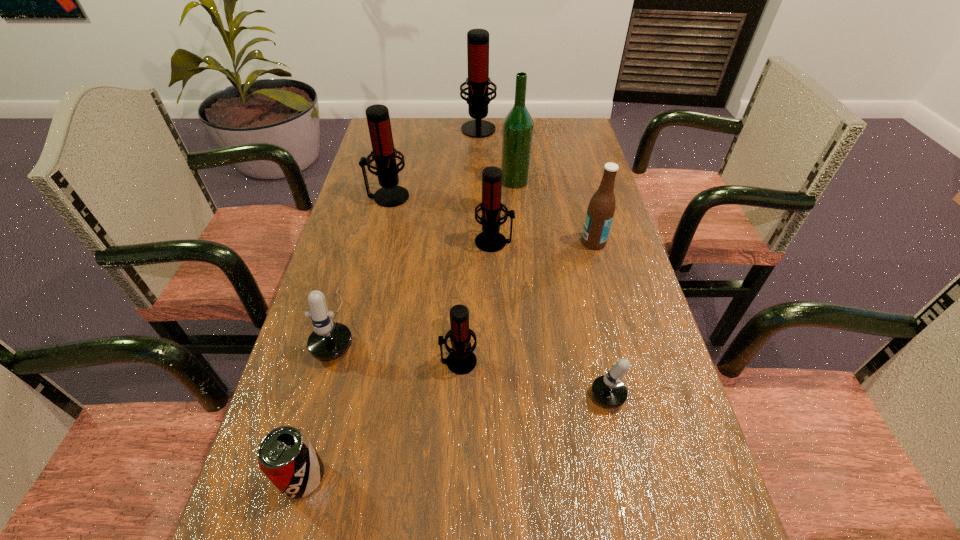
Find the location of a particular element. vacant space located 0.150m on the left of the nearest red microphone is located at coordinates (367, 362).

This screenshot has height=540, width=960. What are the coordinates of `free space located 0.090m on the front of the smaller white microphone` in the screenshot? It's located at (649, 462).

Find the location of `free space located on the back of the nearest object`. free space located on the back of the nearest object is located at coordinates (339, 342).

Identify the location of object that is at the far edge. (478, 81).

Find the location of a particular element. This screenshot has height=540, width=960. soda can at the left edge is located at coordinates (286, 456).

What are the coordinates of `beer bottle present at the right edge` in the screenshot? It's located at (601, 209).

I want to click on microphone located in the right edge section of the desktop, so click(608, 390).

Find the location of a particular element. The width and height of the screenshot is (960, 540). vacant area at the far edge of the desktop is located at coordinates (537, 151).

I want to click on vacant space at the left edge of the desktop, so click(338, 489).

Identify the location of free spot at the right edge of the desktop. Image resolution: width=960 pixels, height=540 pixels. (604, 265).